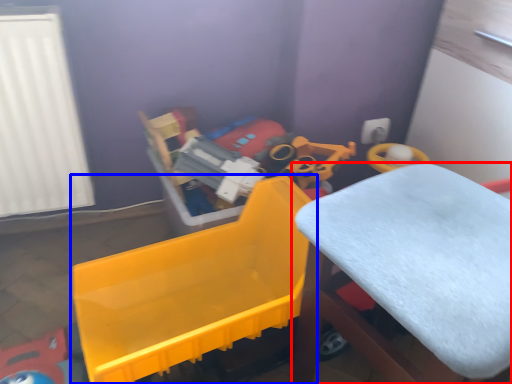
Question: Which point is further to the camera, furniture (highlighted by a red box) or toy (highlighted by a blue box)?

Choices:
 (A) furniture
 (B) toy

Answer: (B)